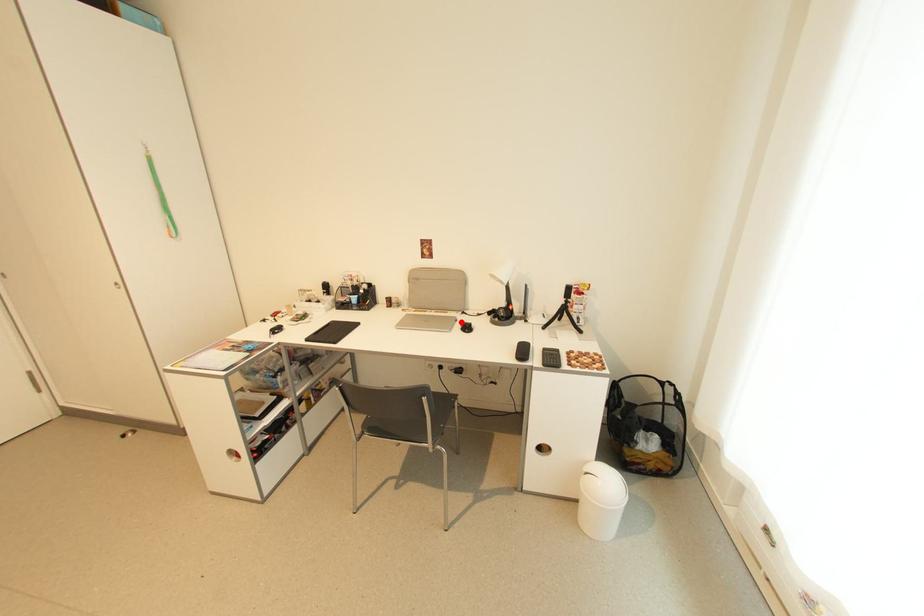
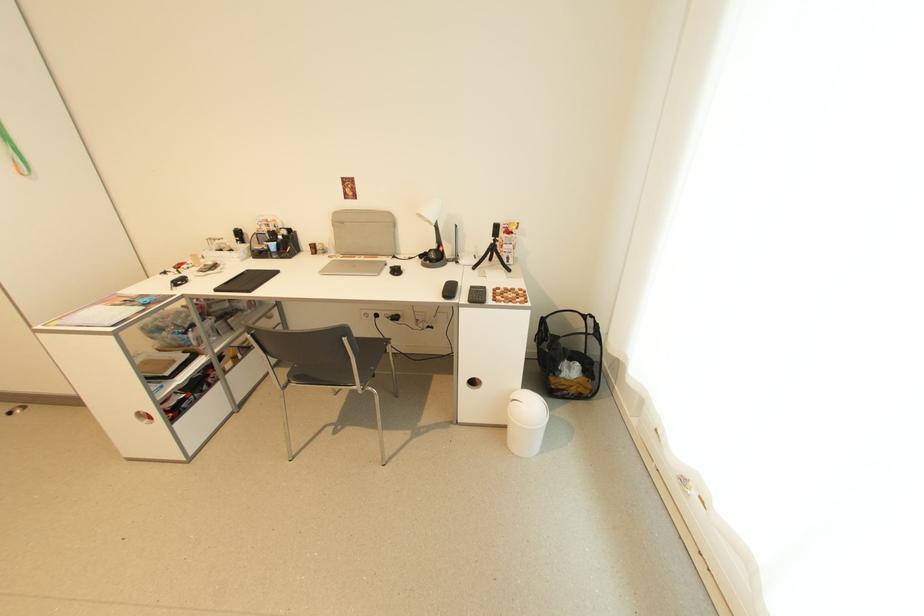
The point at the highlighted location is marked in the first image. Where is the corresponding point in the second image?

(391, 265)